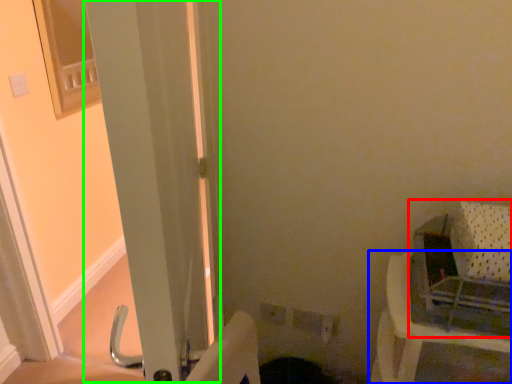
Question: Which object is the farthest from baby carriage (highlighted by a red box)? Choose among these: furniture (highlighted by a blue box) or screen door (highlighted by a green box).

Choices:
 (A) furniture
 (B) screen door

Answer: (B)